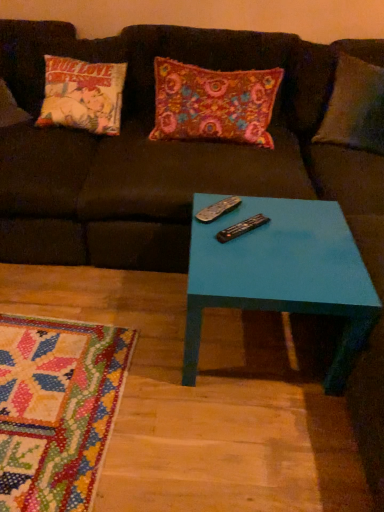
Question: Considering the relative positions of floral fabric pillow at center and black plastic remote at center, which is counted as the 2th remote, starting from the front, in the image provided, is floral fabric pillow at center to the left of black plastic remote at center, which is counted as the 2th remote, starting from the front, from the viewer's perspective?

Choices:
 (A) yes
 (B) no

Answer: (A)

Question: Can you confirm if floral fabric pillow at center is smaller than black plastic remote at center, which is counted as the 2th remote, starting from the front?

Choices:
 (A) no
 (B) yes

Answer: (A)

Question: Does floral fabric pillow at center have a larger size compared to black plastic remote at center, arranged as the 1th remote when viewed from the back?

Choices:
 (A) yes
 (B) no

Answer: (A)

Question: From the image's perspective, is floral fabric pillow at center located above black plastic remote at center, which is counted as the 2th remote, starting from the front?

Choices:
 (A) yes
 (B) no

Answer: (A)

Question: From a real-world perspective, is floral fabric pillow at center below black plastic remote at center, arranged as the 1th remote when viewed from the back?

Choices:
 (A) no
 (B) yes

Answer: (A)

Question: Would you say black plastic remote at center, arranged as the 1th remote when viewed from the back, is to the left or to the right of floral fabric pillow at center in the picture?

Choices:
 (A) left
 (B) right

Answer: (B)

Question: From the image's perspective, relative to floral fabric pillow at center, is black plastic remote at center, arranged as the 1th remote when viewed from the back, above or below?

Choices:
 (A) below
 (B) above

Answer: (A)

Question: From a real-world perspective, is black plastic remote at center, which is counted as the 2th remote, starting from the front, physically located above or below floral fabric pillow at center?

Choices:
 (A) above
 (B) below

Answer: (B)

Question: Looking at their shapes, would you say black plastic remote at center, which is counted as the 2th remote, starting from the front, is wider or thinner than floral fabric pillow at center?

Choices:
 (A) thin
 (B) wide

Answer: (A)

Question: Do you think black plastic remote at center, the 2th remote in the back-to-front sequence, is within floral fabric pillow at center, or outside of it?

Choices:
 (A) inside
 (B) outside

Answer: (B)

Question: Relative to floral fabric pillow at center, is black plastic remote at center, the 2th remote in the back-to-front sequence, in front or behind?

Choices:
 (A) behind
 (B) front

Answer: (B)

Question: Looking at the image, does black plastic remote at center, the 2th remote in the back-to-front sequence, seem bigger or smaller compared to floral fabric pillow at center?

Choices:
 (A) big
 (B) small

Answer: (B)

Question: In the image, is black plastic remote at center, which is the first remote in front-to-back order, on the left side or the right side of floral fabric pillow at center?

Choices:
 (A) left
 (B) right

Answer: (B)

Question: From a real-world perspective, is teal glossy table at center positioned above or below black plastic remote at center, the 2th remote in the back-to-front sequence?

Choices:
 (A) below
 (B) above

Answer: (A)

Question: Based on their positions, is teal glossy table at center located to the left or right of black plastic remote at center, which is the first remote in front-to-back order?

Choices:
 (A) left
 (B) right

Answer: (B)